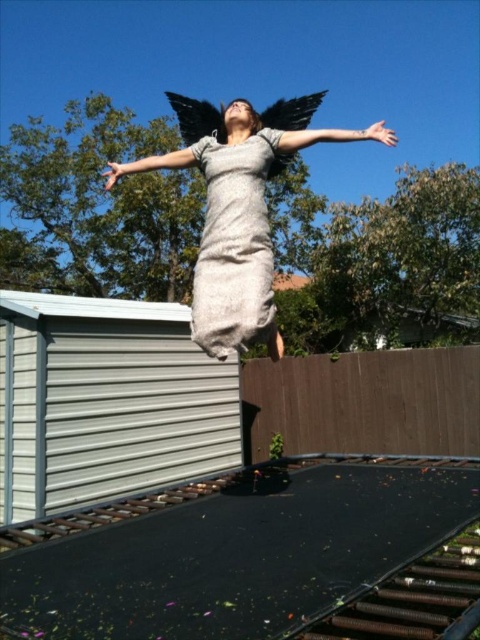
You are a photographer trying to capture the perfect shot of the person jumping off the trampoline. You notice the gray textured dress at center and the matte gray arm at upper center. Which object is positioned lower in the image?

The gray textured dress at center is located below the matte gray arm at upper center, so the gray textured dress at center is positioned lower in the image.

You are standing in the backyard and see two points marked on the trampoline. The first point is at coordinate point (213, 244) and the second is at point (145, 163). Which point is closer to you?

Point (213, 244) is closer to the viewer than point (145, 163).